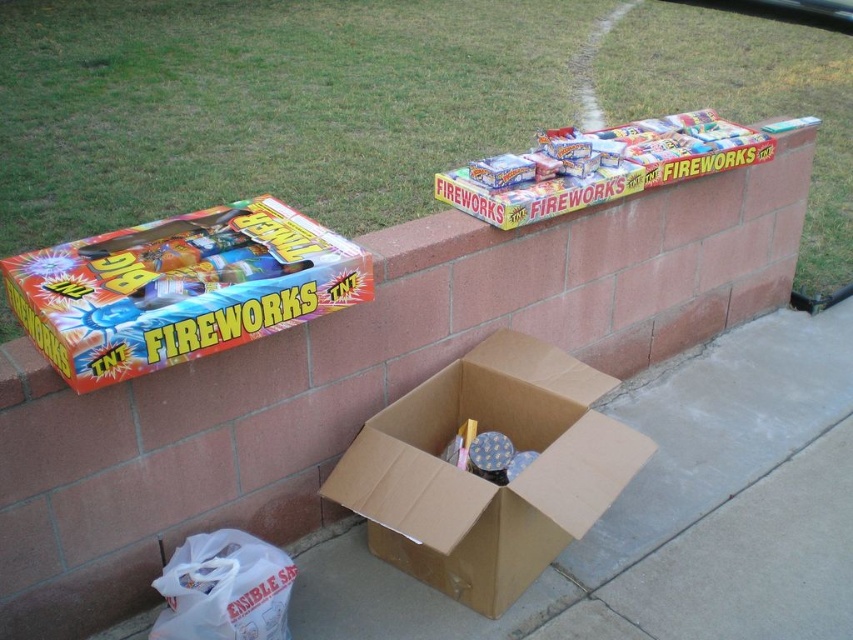
Question: Estimate the real-world distances between objects in this image. Which object is farther from the brown cardboard box at center?

Choices:
 (A) orange glossy fireworks box at left
 (B) white plastic bag at lower left
 (C) brown cardboard box at lower center

Answer: (A)

Question: Is brown cardboard box at lower center to the right of brown cardboard box at center from the viewer's perspective?

Choices:
 (A) yes
 (B) no

Answer: (A)

Question: Can you confirm if brown cardboard box at lower center is wider than brown cardboard box at center?

Choices:
 (A) yes
 (B) no

Answer: (A)

Question: Among these objects, which one is farthest from the camera?

Choices:
 (A) orange glossy fireworks box at left
 (B) brown cardboard box at lower center
 (C) white plastic bag at lower left

Answer: (B)

Question: Is brown cardboard box at center positioned before white plastic bag at lower left?

Choices:
 (A) yes
 (B) no

Answer: (B)

Question: Which is nearer to the white plastic bag at lower left?

Choices:
 (A) orange glossy fireworks box at left
 (B) brown cardboard box at center
 (C) brown cardboard box at lower center

Answer: (B)